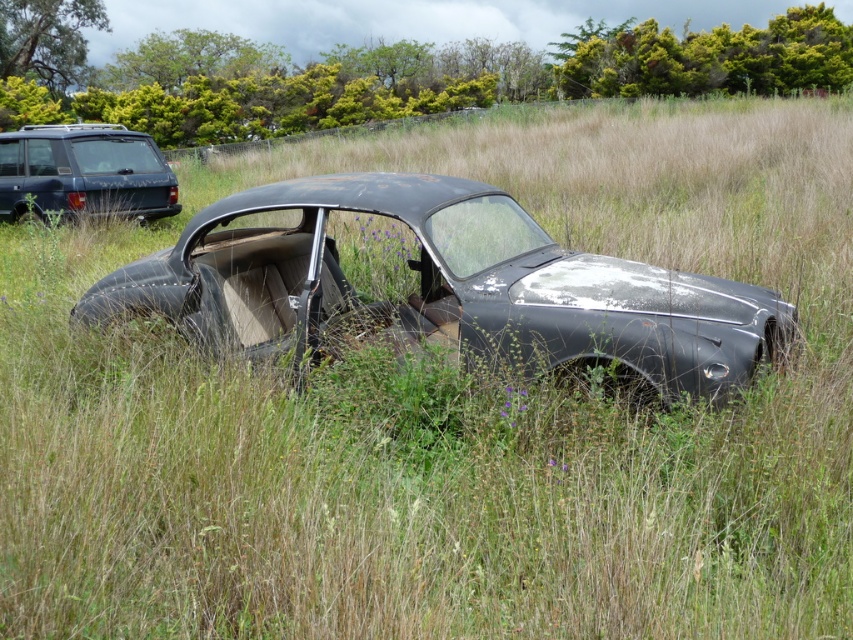
Does point (263, 272) lie behind point (44, 211)?

No, (263, 272) is closer to viewer.

Between point (317, 236) and point (61, 166), which one is positioned in front?

Point (317, 236) is more forward.

The width and height of the screenshot is (853, 640). In order to click on rusty metallic car at center in this screenshot , I will do `click(442, 285)`.